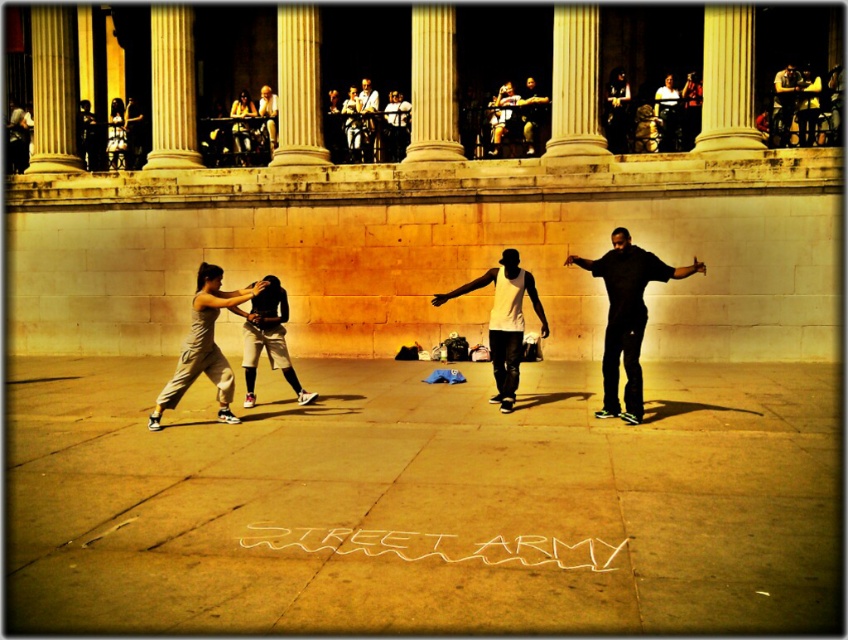
You are a photographer trying to capture a clear shot of the dancers. You notice two key clothing items in the scene, the white matte tank top at center and the light brown leather jacket at center. Which clothing item appears larger in the photo?

The white matte tank top at center appears larger because it is taller than the light brown leather jacket at center.

You are a city planner assessing the space in the plaza. You need to determine if the concrete sidewalk at center can accommodate the matte black tank top at center. Can it fit based on their widths?

The concrete sidewalk at center is wider than the matte black tank top at center, so it can accommodate the matte black tank top at center.

Based on the photo, you are a photographer standing at the edge of the plaza. You want to take a photo of both the dark blue jeans at center and the dark brown leather jacket at center in the same frame. Given that your camera has a minimum focus distance of 2 meters, will you be able to capture both objects in one shot?

The dark blue jeans at center and dark brown leather jacket at center are 2.47 meters apart. Since the distance between them is greater than the camera minimum focus distance of 2 meters, you can capture both objects in one shot.